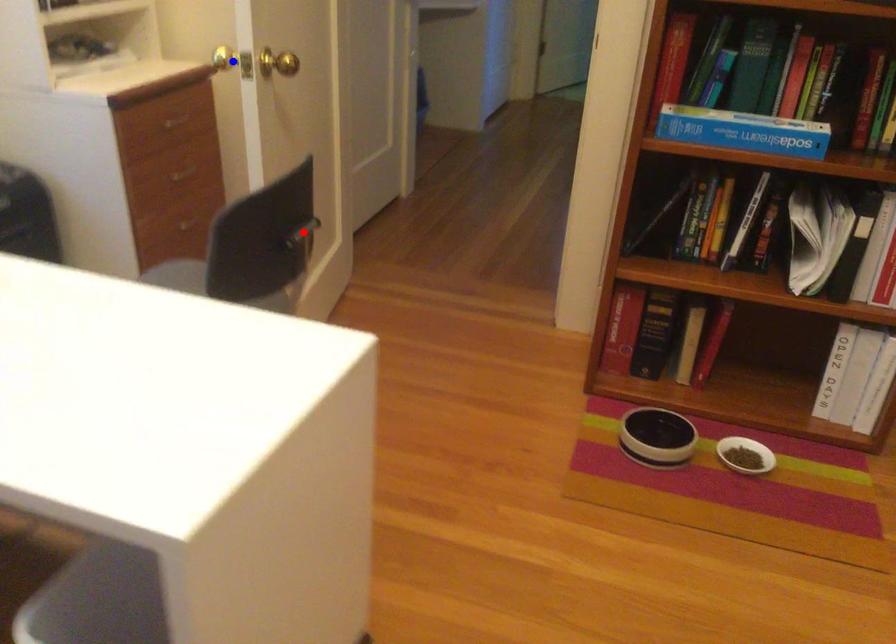
Question: In the image, two points are highlighted. Which point is nearer to the camera? Reply with the corresponding letter.

Choices:
 (A) blue point
 (B) red point

Answer: (A)